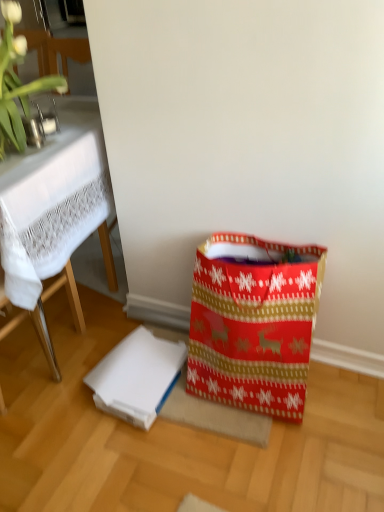
From the picture: What is the approximate width of red paper shopping bag at lower right?

It is 14.91 inches.

Describe the element at coordinates (55, 212) in the screenshot. The width and height of the screenshot is (384, 512). I see `white lace tablecloth at upper left` at that location.

From the picture: What is the approximate height of green leafy plant at upper left?

It is 16.49 inches.

I want to click on red paper shopping bag at lower right, so point(254,323).

Is red paper shopping bag at lower right bigger or smaller than white lace tablecloth at upper left?

red paper shopping bag at lower right is smaller than white lace tablecloth at upper left.

Does red paper shopping bag at lower right have a lesser width compared to white lace tablecloth at upper left?

Indeed, red paper shopping bag at lower right has a lesser width compared to white lace tablecloth at upper left.

This screenshot has width=384, height=512. What are the coordinates of `table positioned vertically above the red paper shopping bag at lower right (from a real-world perspective)` in the screenshot? It's located at (55, 212).

Find the location of a particular element. The width and height of the screenshot is (384, 512). shopping bag directly beneath the green leafy plant at upper left (from a real-world perspective) is located at coordinates (254, 323).

Can we say red paper shopping bag at lower right lies outside green leafy plant at upper left?

Yes.

Which object is positioned more to the right, red paper shopping bag at lower right or green leafy plant at upper left?

red paper shopping bag at lower right.

Is red paper shopping bag at lower right oriented towards green leafy plant at upper left?

No, red paper shopping bag at lower right is not turned towards green leafy plant at upper left.

From the picture: From a real-world perspective, who is located lower, green leafy plant at upper left or white matte cardboard box at lower center?

From a 3D spatial view, white matte cardboard box at lower center is below.

Which object is closer to the camera, green leafy plant at upper left or white matte cardboard box at lower center?

green leafy plant at upper left.

Is green leafy plant at upper left facing towards white matte cardboard box at lower center?

No.

Between green leafy plant at upper left and white matte cardboard box at lower center, which one appears on the left side from the viewer's perspective?

From the viewer's perspective, green leafy plant at upper left appears more on the left side.

Considering the positions of objects white matte cardboard box at lower center and green leafy plant at upper left in the image provided, who is more to the right, white matte cardboard box at lower center or green leafy plant at upper left?

Positioned to the right is white matte cardboard box at lower center.

Is white matte cardboard box at lower center bigger or smaller than green leafy plant at upper left?

Clearly, white matte cardboard box at lower center is smaller in size than green leafy plant at upper left.

At what (x,y) coordinates should I click in order to perform the action: click on orchid located on the left of white matte cardboard box at lower center. Please return your answer as a coordinate pair (x, y). The image size is (384, 512). Looking at the image, I should click on (17, 81).

Based on the photo, can you confirm if white matte cardboard box at lower center is taller than green leafy plant at upper left?

No.

Considering the relative sizes of white lace tablecloth at upper left and green leafy plant at upper left in the image provided, is white lace tablecloth at upper left smaller than green leafy plant at upper left?

Actually, white lace tablecloth at upper left might be larger than green leafy plant at upper left.

Is white lace tablecloth at upper left facing away from green leafy plant at upper left?

white lace tablecloth at upper left is not turned away from green leafy plant at upper left.

Between point (91, 217) and point (2, 83), which one is positioned in front?

The point (2, 83) is in front.

Is point (3, 150) behind point (81, 98)?

No.

Between green leafy plant at upper left and white lace tablecloth at upper left, which one has larger size?

With larger size is white lace tablecloth at upper left.

Are green leafy plant at upper left and white lace tablecloth at upper left beside each other?

There is a gap between green leafy plant at upper left and white lace tablecloth at upper left.

Does green leafy plant at upper left turn towards white lace tablecloth at upper left?

Yes, green leafy plant at upper left is aimed at white lace tablecloth at upper left.

Is white lace tablecloth at upper left looking in the opposite direction of white matte cardboard box at lower center?

No, white lace tablecloth at upper left's orientation is not away from white matte cardboard box at lower center.

Is white lace tablecloth at upper left directly adjacent to white matte cardboard box at lower center?

white lace tablecloth at upper left and white matte cardboard box at lower center are not in contact.

Is white lace tablecloth at upper left in front of or behind white matte cardboard box at lower center in the image?

In the image, white lace tablecloth at upper left appears in front of white matte cardboard box at lower center.

Considering the relative sizes of white lace tablecloth at upper left and white matte cardboard box at lower center in the image provided, is white lace tablecloth at upper left bigger than white matte cardboard box at lower center?

Yes.

Locate an element on the screen. The width and height of the screenshot is (384, 512). shopping bag below the white lace tablecloth at upper left (from the image's perspective) is located at coordinates (254, 323).

This screenshot has height=512, width=384. What are the coordinates of `orchid in front of the red paper shopping bag at lower right` in the screenshot? It's located at (17, 81).

When comparing their distances from white lace tablecloth at upper left, does white matte cardboard box at lower center or red paper shopping bag at lower right seem further?

Based on the image, red paper shopping bag at lower right appears to be further to white lace tablecloth at upper left.

Consider the image. Based on their spatial positions, is red paper shopping bag at lower right or white lace tablecloth at upper left closer to white matte cardboard box at lower center?

Based on the image, red paper shopping bag at lower right appears to be nearer to white matte cardboard box at lower center.

From the picture: Based on their spatial positions, is green leafy plant at upper left or white matte cardboard box at lower center closer to red paper shopping bag at lower right?

white matte cardboard box at lower center lies closer to red paper shopping bag at lower right than the other object.

Estimate the real-world distances between objects in this image. Which object is further from red paper shopping bag at lower right, white matte cardboard box at lower center or white lace tablecloth at upper left?

white lace tablecloth at upper left is further to red paper shopping bag at lower right.

Based on their spatial positions, is red paper shopping bag at lower right or white matte cardboard box at lower center closer to green leafy plant at upper left?

white matte cardboard box at lower center lies closer to green leafy plant at upper left than the other object.

Considering their positions, is white matte cardboard box at lower center positioned closer to white lace tablecloth at upper left than green leafy plant at upper left?

green leafy plant at upper left lies closer to white lace tablecloth at upper left than the other object.

Estimate the real-world distances between objects in this image. Which object is closer to green leafy plant at upper left, white lace tablecloth at upper left or red paper shopping bag at lower right?

Based on the image, white lace tablecloth at upper left appears to be nearer to green leafy plant at upper left.

Based on their spatial positions, is red paper shopping bag at lower right or green leafy plant at upper left further from white lace tablecloth at upper left?

red paper shopping bag at lower right is further to white lace tablecloth at upper left.

Identify the location of table between green leafy plant at upper left and white matte cardboard box at lower center in the up-down direction. (55, 212).

Identify the location of orchid between white lace tablecloth at upper left and red paper shopping bag at lower right in the horizontal direction. This screenshot has width=384, height=512. (17, 81).

At what (x,y) coordinates should I click in order to perform the action: click on cardboard box between white lace tablecloth at upper left and red paper shopping bag at lower right in the horizontal direction. Please return your answer as a coordinate pair (x, y). Looking at the image, I should click on (137, 377).

You are a GUI agent. You are given a task and a screenshot of the screen. Output one action in this format:
    pyautogui.click(x=<x>, y=<y>)
    Task: Click on the shopping bag between green leafy plant at upper left and white matte cardboard box at lower center from top to bottom
    The image size is (384, 512).
    Given the screenshot: What is the action you would take?
    coord(254,323)